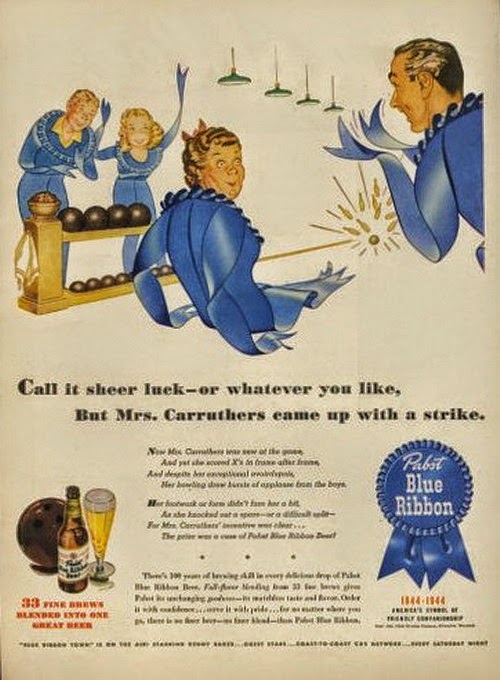
At what (x,y) coordinates should I click in order to perform the action: click on canvas. Please return your answer as a coordinate pair (x, y). Looking at the image, I should click on (422, 303).